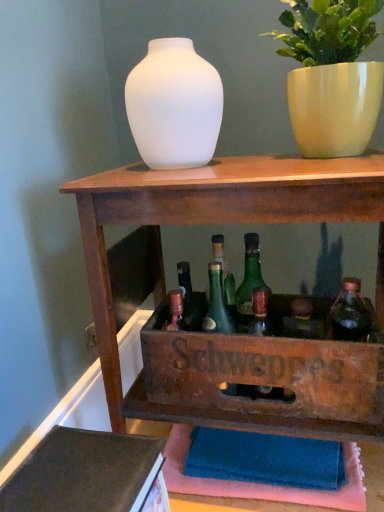
You are a GUI agent. You are given a task and a screenshot of the screen. Output one action in this format:
    pyautogui.click(x=<x>, y=<y>)
    Task: Click on the vacant space in front of white glossy pot at upper right
    
    Given the screenshot: What is the action you would take?
    pyautogui.click(x=311, y=167)